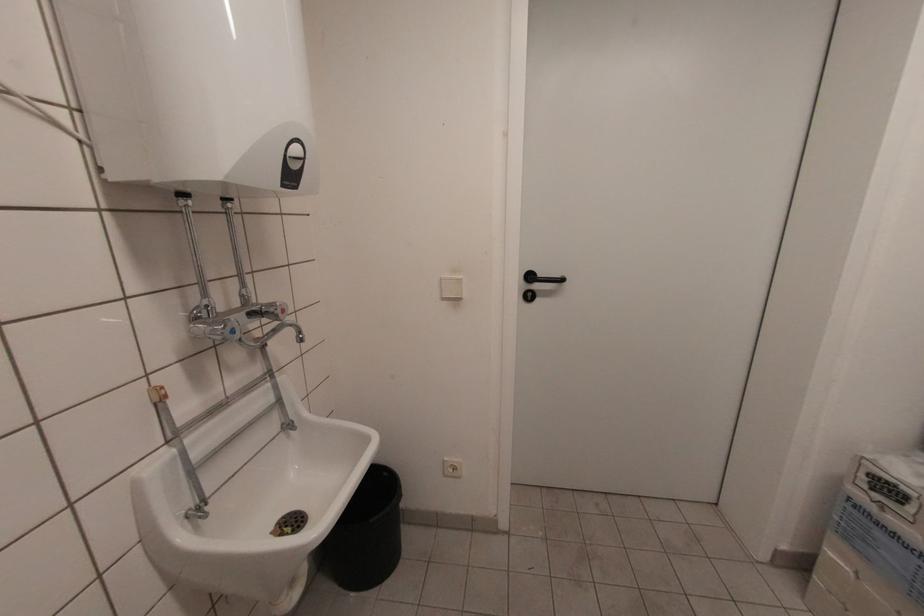
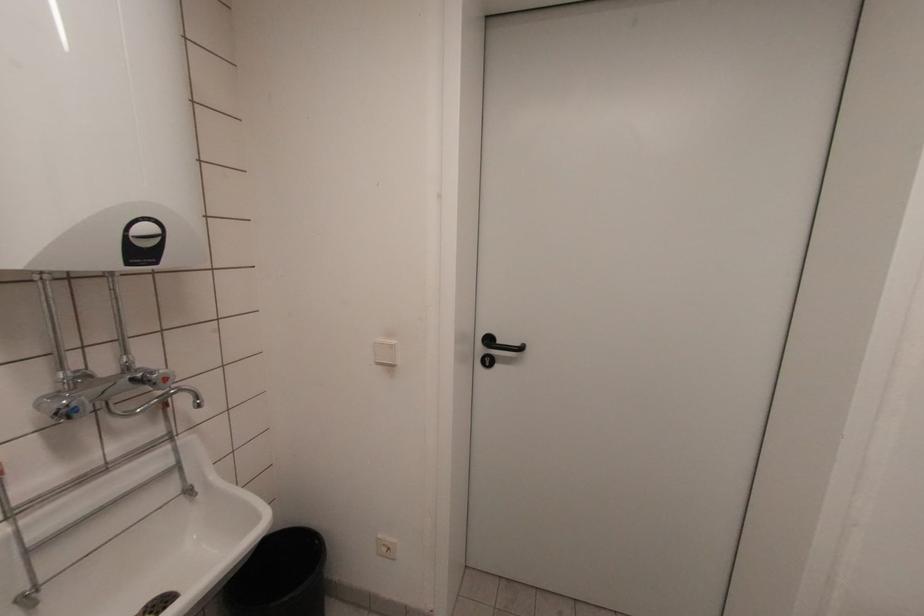
Where in the second image is the point corresponding to point 295,185 from the first image?

(151, 261)